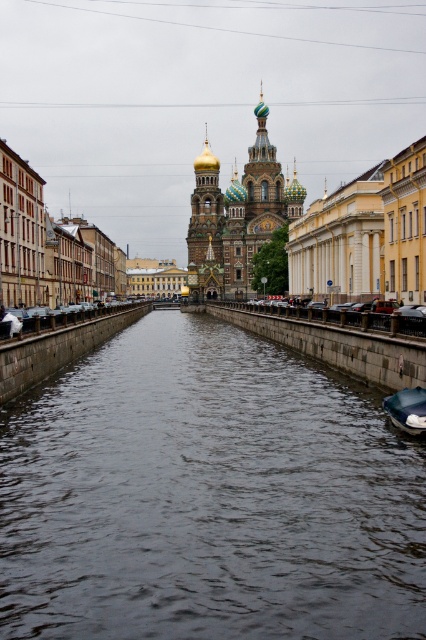
Question: Among these points, which one is farthest from the camera?

Choices:
 (A) (400, 410)
 (B) (46, 412)

Answer: (B)

Question: Which of the following is the closest to the observer?

Choices:
 (A) golden domed cathedral at center
 (B) dark gray concrete river at center
 (C) dark blue fabric boat at lower right

Answer: (B)

Question: Can you confirm if dark gray concrete river at center is positioned to the right of dark blue fabric boat at lower right?

Choices:
 (A) no
 (B) yes

Answer: (A)

Question: Which of the following is the closest to the observer?

Choices:
 (A) dark blue fabric boat at lower right
 (B) golden domed cathedral at center

Answer: (A)

Question: Can you confirm if dark gray concrete river at center is positioned below golden domed cathedral at center?

Choices:
 (A) yes
 (B) no

Answer: (A)

Question: Does dark gray concrete river at center have a lesser width compared to golden domed cathedral at center?

Choices:
 (A) no
 (B) yes

Answer: (A)